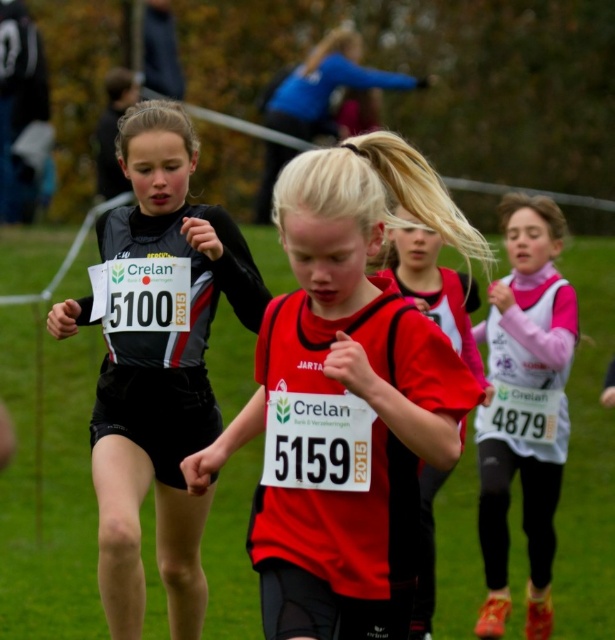
Does black matte jersey at left come behind pink fabric bib at right?

No, it is not.

Is black matte jersey at left positioned in front of pink fabric bib at right?

Yes, black matte jersey at left is closer to the viewer.

Measure the distance between point (x=186, y=170) and camera.

Point (x=186, y=170) and camera are 17.63 feet apart.

Identify the location of black matte jersey at left. The width and height of the screenshot is (615, 640). (161, 374).

Which is more to the left, black matte jersey at left or red matte jersey at center?

black matte jersey at left

Is black matte jersey at left bigger than red matte jersey at center?

Indeed, black matte jersey at left has a larger size compared to red matte jersey at center.

Measure the distance between black matte jersey at left and camera.

They are 16.01 feet apart.

The height and width of the screenshot is (640, 615). In order to click on black matte jersey at left in this screenshot , I will do `click(161, 374)`.

Who is lower down, matte red shirt at center or red matte jersey at center?

Positioned lower is matte red shirt at center.

Does matte red shirt at center have a smaller size compared to red matte jersey at center?

Incorrect, matte red shirt at center is not smaller in size than red matte jersey at center.

Is point (304, 404) in front of point (456, 289)?

That is True.

The height and width of the screenshot is (640, 615). I want to click on matte red shirt at center, so click(347, 397).